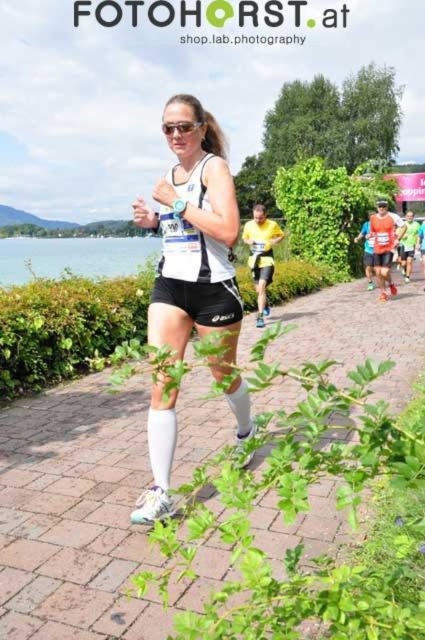
Is white fabric shorts at center to the right of yellow fabric shirt at center from the viewer's perspective?

Indeed, white fabric shorts at center is positioned on the right side of yellow fabric shirt at center.

Does white fabric shorts at center have a greater height compared to yellow fabric shirt at center?

Incorrect, white fabric shorts at center's height is not larger of yellow fabric shirt at center's.

What do you see at coordinates (76, 515) in the screenshot? I see `white fabric shorts at center` at bounding box center [76, 515].

Locate an element on the screen. The image size is (425, 640). white fabric shorts at center is located at coordinates (76, 515).

From the picture: Between white fabric shorts at center and white matte running shorts at center, which one is positioned higher?

Positioned higher is white matte running shorts at center.

In the scene shown: Does white fabric shorts at center have a lesser width compared to white matte running shorts at center?

Incorrect, white fabric shorts at center's width is not less than white matte running shorts at center's.

Is point (370, 344) positioned after point (170, 196)?

Yes, point (370, 344) is behind point (170, 196).

The width and height of the screenshot is (425, 640). I want to click on white fabric shorts at center, so click(76, 515).

Image resolution: width=425 pixels, height=640 pixels. What do you see at coordinates (193, 234) in the screenshot? I see `white matte running shorts at center` at bounding box center [193, 234].

Does point (153, 289) lie in front of point (260, 236)?

Yes.

Identify the location of white matte running shorts at center. Image resolution: width=425 pixels, height=640 pixels. (193, 234).